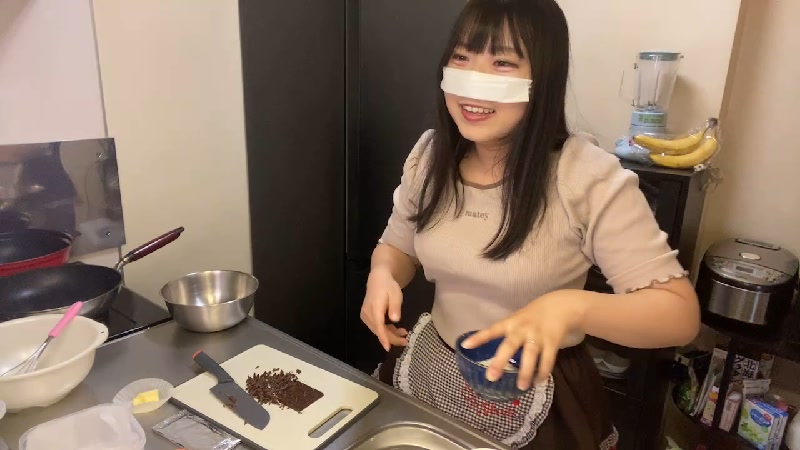
Locate an element on the screen. The width and height of the screenshot is (800, 450). stainless steel bowl is located at coordinates (205, 302).